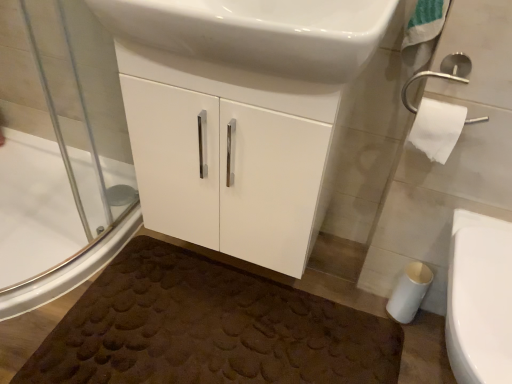
Question: Do you think white glossy sink at upper center is within white matte toilet paper at lower right, arranged as the 1th toilet paper when ordered from the bottom, or outside of it?

Choices:
 (A) outside
 (B) inside

Answer: (A)

Question: Is white glossy sink at upper center in front of or behind white matte toilet paper at lower right, arranged as the 1th toilet paper when ordered from the bottom, in the image?

Choices:
 (A) front
 (B) behind

Answer: (A)

Question: Estimate the real-world distances between objects in this image. Which object is farther from the white glossy bidet at lower right?

Choices:
 (A) transparent glass shower door at left
 (B) brown textured bath mat at lower center
 (C) white glossy sink at upper center
 (D) white glossy cabinet at center
 (E) white paper at upper right, the 1th toilet paper when ordered from top to bottom

Answer: (A)

Question: Which is farther from the white glossy bidet at lower right?

Choices:
 (A) white matte toilet paper at lower right, the 2th toilet paper in the top-to-bottom sequence
 (B) white glossy sink at upper center
 (C) transparent glass shower door at left
 (D) brown textured bath mat at lower center
 (E) white paper at upper right, arranged as the second toilet paper when ordered from the bottom

Answer: (C)